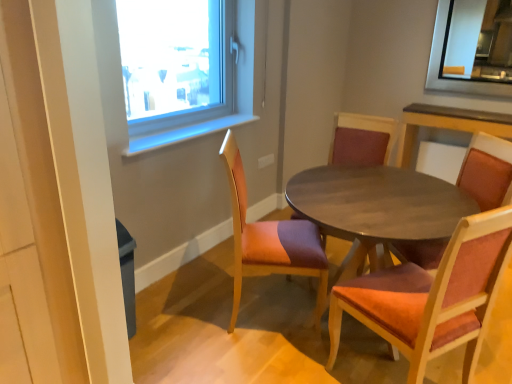
Question: Should I look upward or downward to see wooden textured chair at center, acting as the first chair starting from the left?

Choices:
 (A) up
 (B) down

Answer: (B)

Question: Could you tell me if wooden chair with red cushion at center, placed as the third chair when sorted from right to left, is turned towards velvet orange chair at center, the 3th chair positioned from the left?

Choices:
 (A) yes
 (B) no

Answer: (B)

Question: From the image's perspective, does wooden chair with red cushion at center, which appears as the 2th chair when viewed from the left, appear lower than velvet orange chair at center, the 3th chair positioned from the left?

Choices:
 (A) no
 (B) yes

Answer: (A)

Question: Can you confirm if wooden chair with red cushion at center, placed as the third chair when sorted from right to left, is shorter than velvet orange chair at center, the 3th chair positioned from the left?

Choices:
 (A) no
 (B) yes

Answer: (A)

Question: Is wooden chair with red cushion at center, which appears as the 2th chair when viewed from the left, smaller than velvet orange chair at center, the 3th chair positioned from the left?

Choices:
 (A) yes
 (B) no

Answer: (B)

Question: Considering the relative sizes of wooden chair with red cushion at center, placed as the third chair when sorted from right to left, and velvet orange chair at center, the second chair positioned from the right, in the image provided, is wooden chair with red cushion at center, placed as the third chair when sorted from right to left, thinner than velvet orange chair at center, the second chair positioned from the right,?

Choices:
 (A) yes
 (B) no

Answer: (A)

Question: From a real-world perspective, is wooden chair with red cushion at center, placed as the third chair when sorted from right to left, physically above velvet orange chair at center, the second chair positioned from the right?

Choices:
 (A) yes
 (B) no

Answer: (A)

Question: Is velvet orange chair at center, the 3th chair positioned from the left, positioned in front of wooden chair with red cushion at center, placed as the third chair when sorted from right to left?

Choices:
 (A) yes
 (B) no

Answer: (A)

Question: From the image's perspective, is velvet orange chair at center, the second chair positioned from the right, under wooden chair with red cushion at center, placed as the third chair when sorted from right to left?

Choices:
 (A) yes
 (B) no

Answer: (A)

Question: Is velvet orange chair at center, the 3th chair positioned from the left, smaller than wooden chair with red cushion at center, which appears as the 2th chair when viewed from the left?

Choices:
 (A) yes
 (B) no

Answer: (A)

Question: Is wooden chair with red cushion at center, which appears as the 2th chair when viewed from the left, at the back of velvet orange chair at center, the second chair positioned from the right?

Choices:
 (A) no
 (B) yes

Answer: (A)

Question: Can you confirm if velvet orange chair at center, the second chair positioned from the right, is shorter than wooden chair with red cushion at center, which appears as the 2th chair when viewed from the left?

Choices:
 (A) no
 (B) yes

Answer: (B)

Question: Would you say velvet orange chair at center, the second chair positioned from the right, is outside wooden chair with red cushion at center, which appears as the 2th chair when viewed from the left?

Choices:
 (A) yes
 (B) no

Answer: (A)

Question: From a real-world perspective, does wooden chair with red cushion at center, which appears as the 2th chair when viewed from the left, stand above wooden table at center?

Choices:
 (A) yes
 (B) no

Answer: (A)